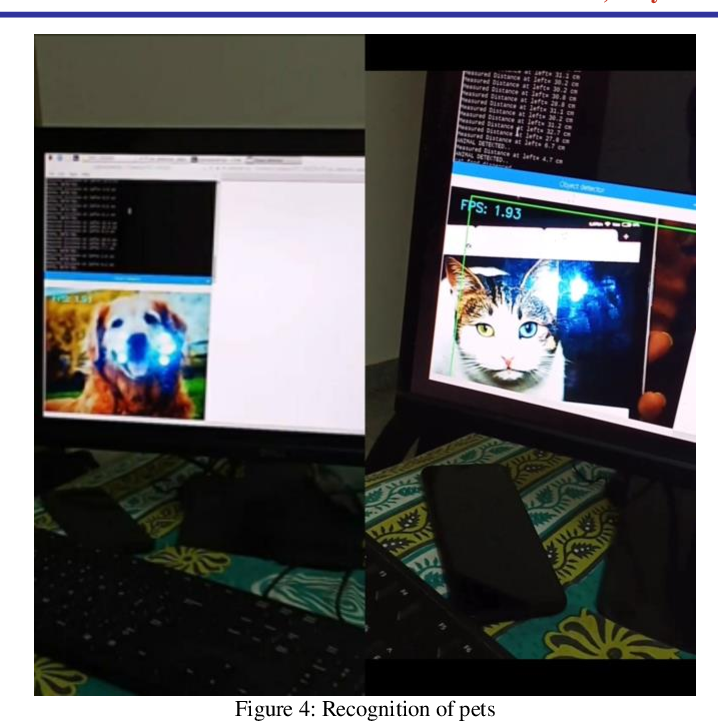
At what (x,y) coordinates should I click in order to perform the action: click on monitor. Please return your answer as a coordinate pair (x, y). Looking at the image, I should click on (600, 373).